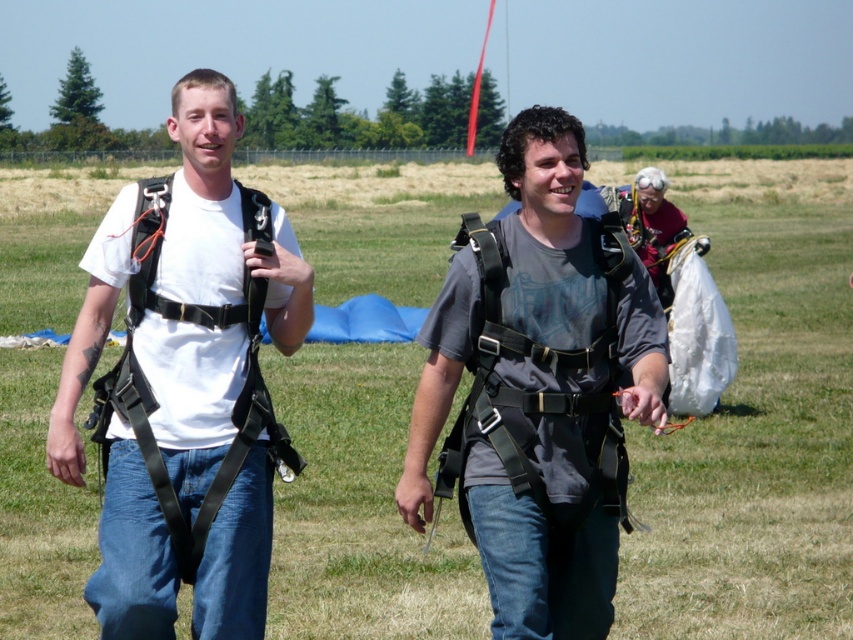
Can you confirm if black matte harness at left is positioned below gray matte harness at center?

No, black matte harness at left is not below gray matte harness at center.

Is black matte harness at left thinner than gray matte harness at center?

No.

The width and height of the screenshot is (853, 640). I want to click on black matte harness at left, so click(x=184, y=381).